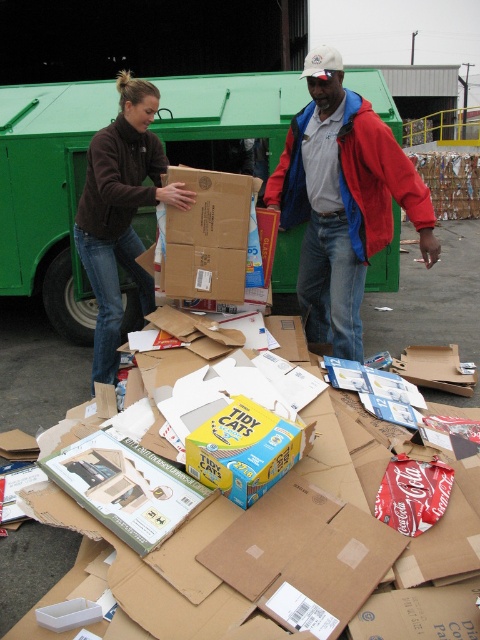
Is green cardboard garbage truck at upper left thinner than dark brown fleece at center?

No.

Is point (51, 202) positioned before point (119, 173)?

No, it is behind (119, 173).

Who is more distant from viewer, (55, 236) or (151, 93)?

The point (55, 236) is more distant.

Where is `green cardboard garbage truck at upper left`? Image resolution: width=480 pixels, height=640 pixels. green cardboard garbage truck at upper left is located at coordinates (48, 195).

Is dark brown fleece at center to the left of matte brown cardboard box at center from the viewer's perspective?

Correct, you'll find dark brown fleece at center to the left of matte brown cardboard box at center.

Between point (121, 150) and point (183, 273), which one is positioned behind?

Point (121, 150)

The image size is (480, 640). What do you see at coordinates (120, 212) in the screenshot?
I see `dark brown fleece at center` at bounding box center [120, 212].

Find the location of a particular element. The height and width of the screenshot is (640, 480). dark brown fleece at center is located at coordinates (120, 212).

Does red jacket at center appear over matte brown cardboard box at center?

Indeed, red jacket at center is positioned over matte brown cardboard box at center.

From the picture: Who is shorter, red jacket at center or matte brown cardboard box at center?

Standing shorter between the two is matte brown cardboard box at center.

Identify the location of red jacket at center. (343, 200).